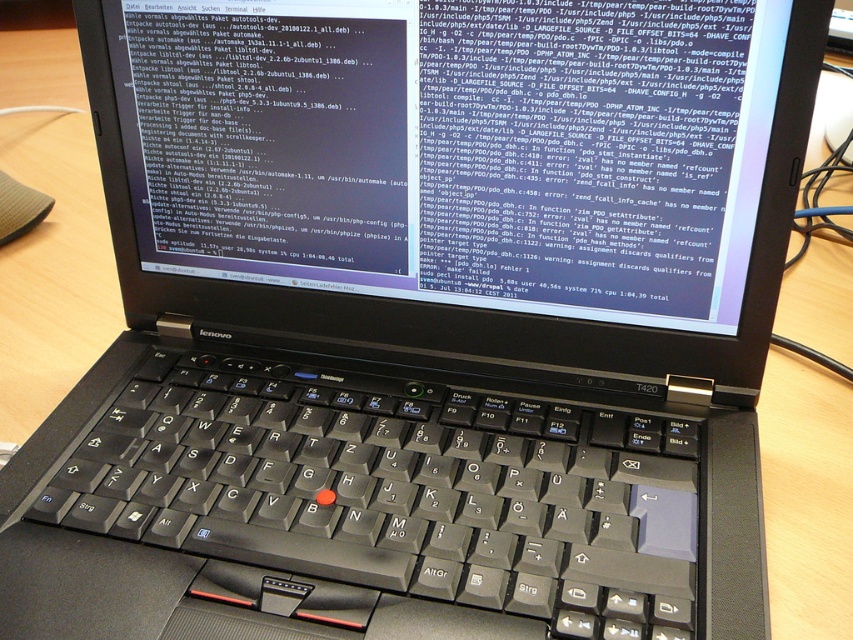
You are holding a ruler and want to measure the distance between the point at coordinates (732,308) and the edge of the laptop screen. The ruler is 12 inches long. Can you reach the point with your ruler?

The point at coordinates (732,308) is 18.31 inches away from the camera, so the ruler that is 12 inches long is not long enough to reach the point.

You are a software developer working on this laptop. You need to check the size of the screen and keyboard to ensure they meet your ergonomic requirements. Which object has a larger size between the black glossy screen at upper center and the black matte keyboard at center?

The black glossy screen at upper center is larger in size than the black matte keyboard at center according to the description.

You are a user trying to type a command on the black glossy screen at upper center. However, you can only reach the black matte keyboard at center. Is the keyboard positioned below the screen?

Yes, the black matte keyboard at center is positioned below the black glossy screen at upper center since the screen is above the keyboard.